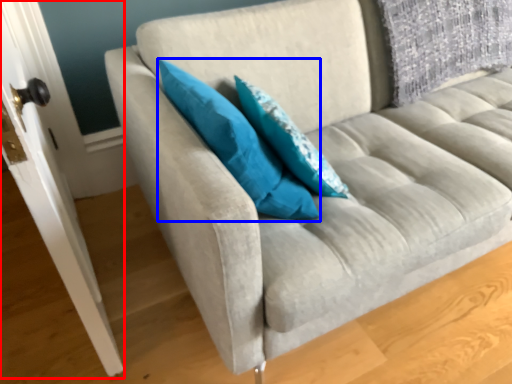
Question: Which object appears farthest to the camera in this image, door (highlighted by a red box) or pillow (highlighted by a blue box)?

Choices:
 (A) door
 (B) pillow

Answer: (B)